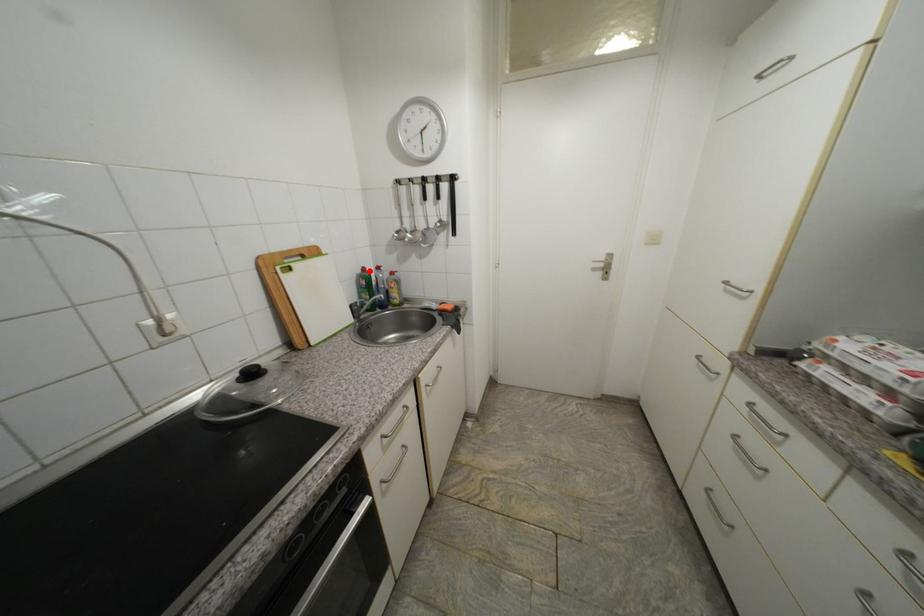
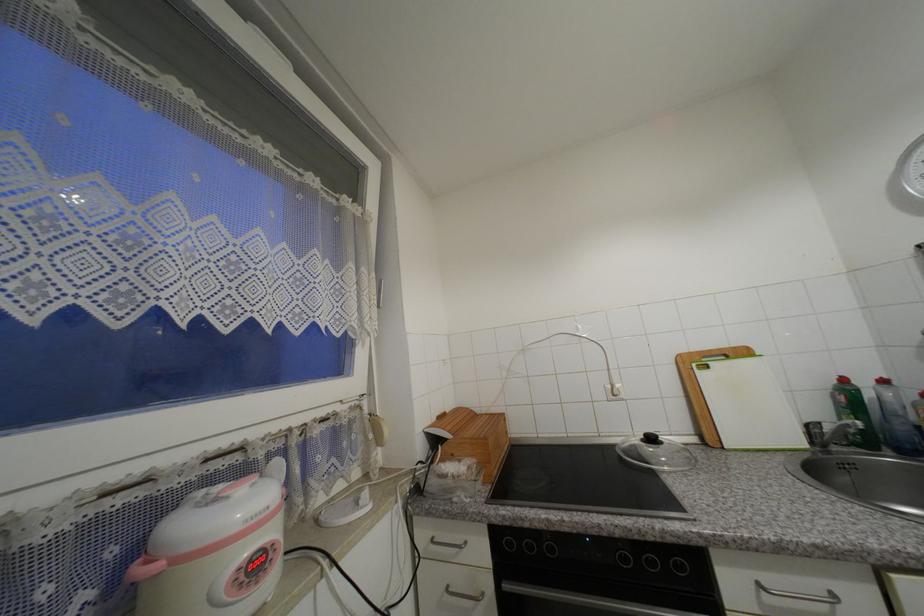
In the second image, find the point that corresponds to the highlighted location in the first image.

(849, 381)